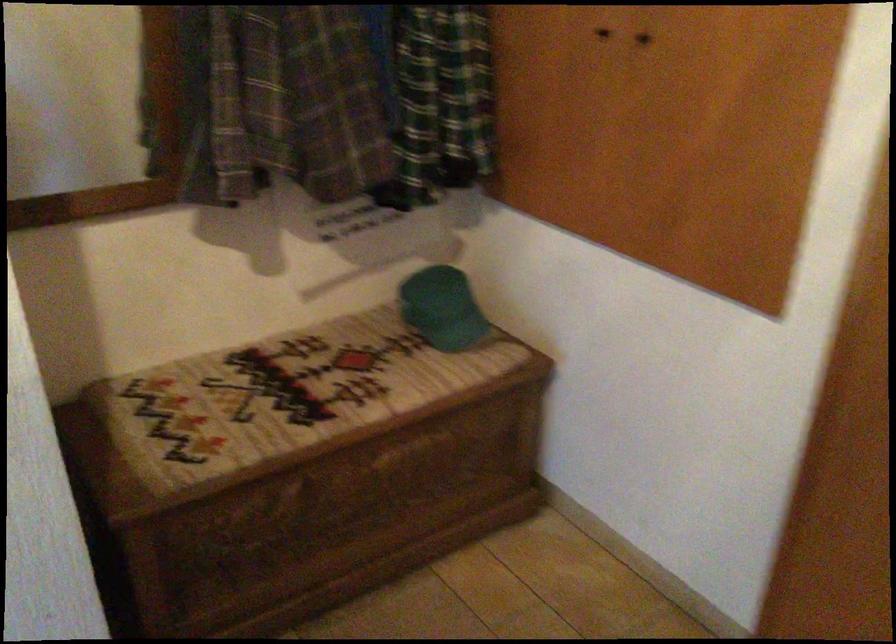
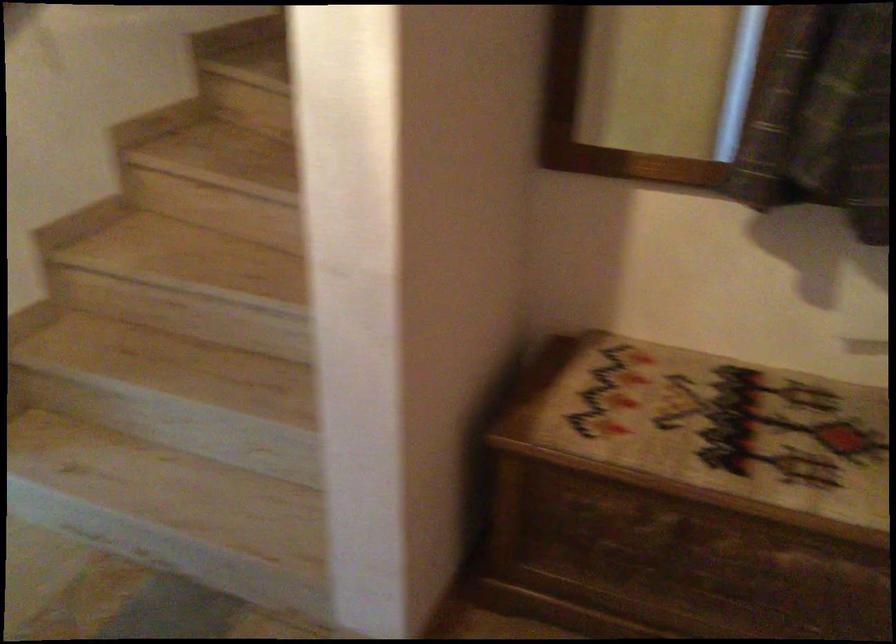
In the second image, find the point that corresponds to (277,406) in the first image.

(709, 431)